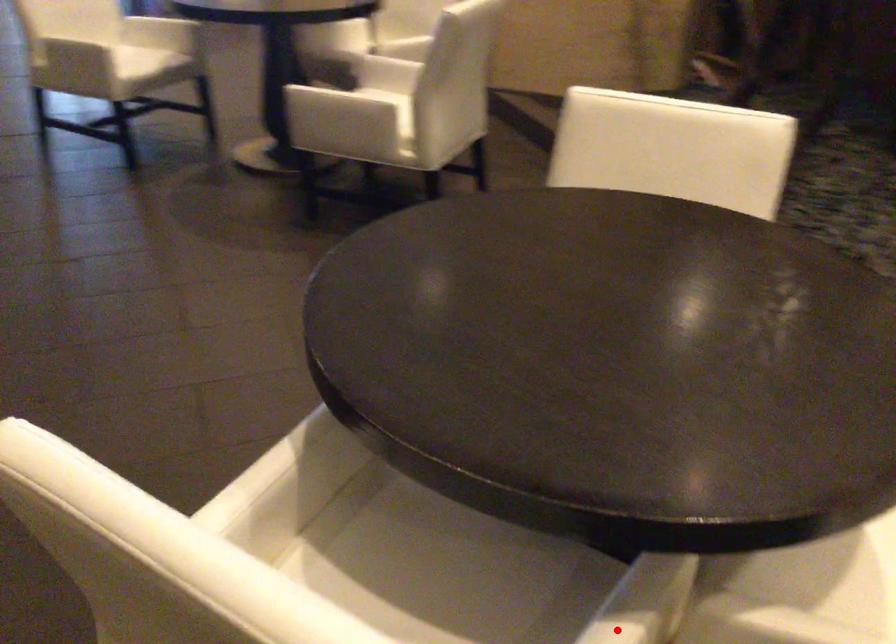
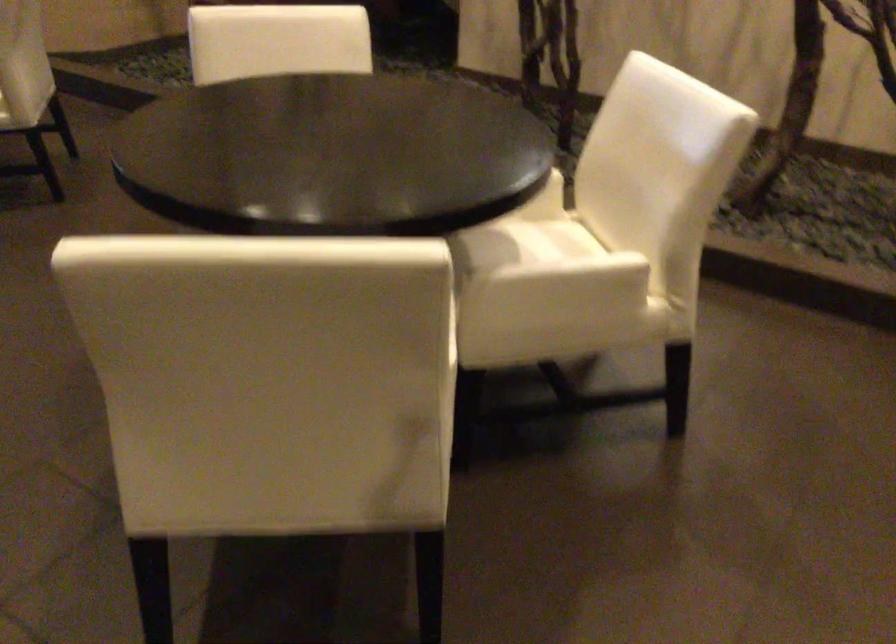
Question: I am providing you with two images of the same scene from different viewpoints. A red point is marked on the first image. Can you still see the location of the red point in image 2?

Choices:
 (A) Yes
 (B) No

Answer: (B)